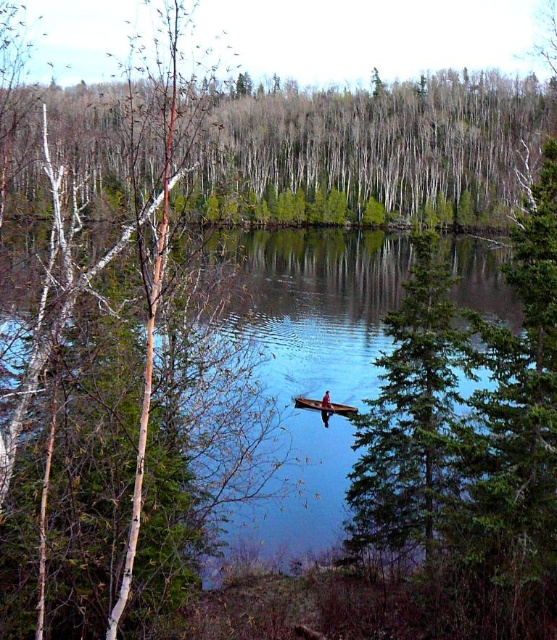
Which of these two, green leafy trees at upper center or wooden canoe at center, stands taller?

green leafy trees at upper center

How distant is green leafy trees at upper center from wooden canoe at center?

The distance of green leafy trees at upper center from wooden canoe at center is 119.32 feet.

Describe the element at coordinates (385, 144) in the screenshot. I see `green leafy trees at upper center` at that location.

Where is `green leafy trees at upper center`? green leafy trees at upper center is located at coordinates (385, 144).

Between brown wooden canoe at center and wooden canoe at center, which one is positioned higher?

Positioned higher is brown wooden canoe at center.

Is brown wooden canoe at center shorter than wooden canoe at center?

Indeed, brown wooden canoe at center has a lesser height compared to wooden canoe at center.

Who is more distant from viewer, (325, 404) or (324, 410)?

The point (325, 404) is behind.

Locate an element on the screen. This screenshot has width=557, height=640. brown wooden canoe at center is located at coordinates (324, 404).

Between clear blue water at center and brown wooden canoe at center, which one is positioned higher?

clear blue water at center is above.

Which of these two, clear blue water at center or brown wooden canoe at center, stands shorter?

brown wooden canoe at center is shorter.

Is point (260, 321) closer to viewer compared to point (297, 404)?

No, (260, 321) is further to viewer.

This screenshot has width=557, height=640. Identify the location of clear blue water at center. (316, 305).